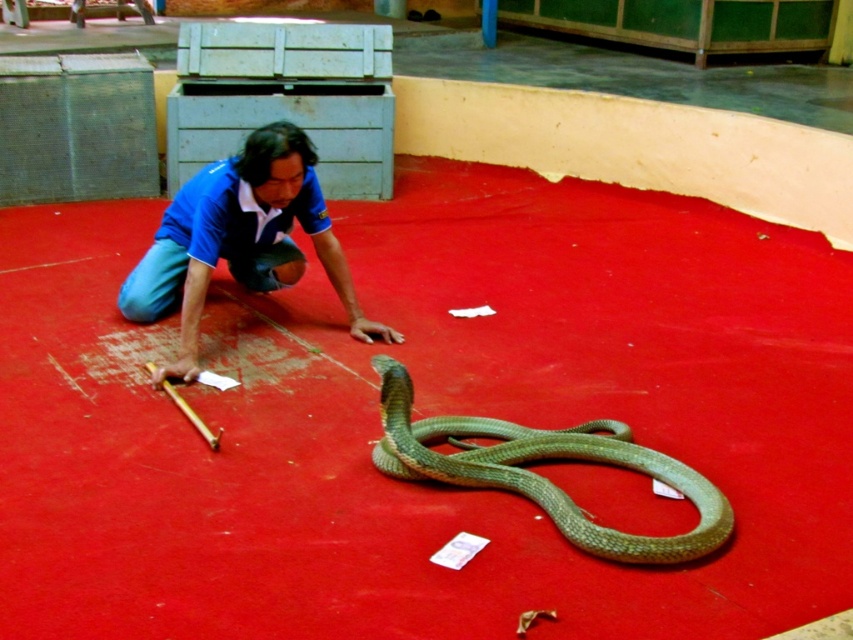
Question: Which point is closer to the camera?

Choices:
 (A) green scaly snake at center
 (B) blue cotton shirt at center

Answer: (A)

Question: Is blue cotton shirt at center above green scaly snake at center?

Choices:
 (A) no
 (B) yes

Answer: (B)

Question: Is blue cotton shirt at center smaller than green scaly snake at center?

Choices:
 (A) yes
 (B) no

Answer: (B)

Question: Can you confirm if blue cotton shirt at center is smaller than green scaly snake at center?

Choices:
 (A) yes
 (B) no

Answer: (B)